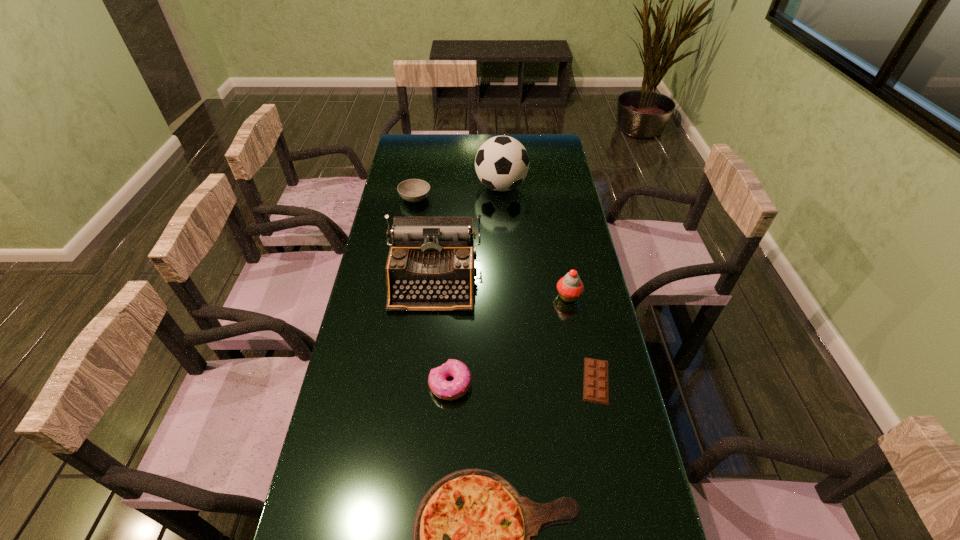
The image size is (960, 540). I want to click on free location at the far right corner of the desktop, so click(x=540, y=148).

This screenshot has height=540, width=960. I want to click on vacant area that lies between the tallest object and the bowl, so click(x=458, y=192).

Identify the location of vacant space in between the tallest object and the cupcake. The width and height of the screenshot is (960, 540). (535, 241).

Where is `vacant area that lies between the third tallest object and the typewriter`? The width and height of the screenshot is (960, 540). vacant area that lies between the third tallest object and the typewriter is located at coordinates (501, 287).

The height and width of the screenshot is (540, 960). Find the location of `vacant space in between the doughnut and the chocolate bar`. vacant space in between the doughnut and the chocolate bar is located at coordinates (523, 382).

Locate which object ranks fifth in proximity to the fifth shortest object. Please provide its 2D coordinates. Your answer should be formatted as a tuple, i.e. [(x, y)], where the tuple contains the x and y coordinates of a point satisfying the conditions above.

[(474, 536)]

Locate an element on the screen. Image resolution: width=960 pixels, height=540 pixels. object that can be found as the fourth closest to the doughnut is located at coordinates (570, 287).

Where is `vacant area in the image that satisfies the following two spatial constraints: 1. on the front side of the chocolate bar; 2. on the right side of the soccer ball`? The height and width of the screenshot is (540, 960). vacant area in the image that satisfies the following two spatial constraints: 1. on the front side of the chocolate bar; 2. on the right side of the soccer ball is located at coordinates (513, 381).

At what (x,y) coordinates should I click in order to perform the action: click on vacant space that satisfies the following two spatial constraints: 1. on the keyboard of the typewriter; 2. on the left side of the chocolate bar. Please return your answer as a coordinate pair (x, y). The width and height of the screenshot is (960, 540). Looking at the image, I should click on (423, 381).

Find the location of `free spot that satisfies the following two spatial constraints: 1. on the back side of the doughnut; 2. on the right side of the third tallest object`. free spot that satisfies the following two spatial constraints: 1. on the back side of the doughnut; 2. on the right side of the third tallest object is located at coordinates (455, 296).